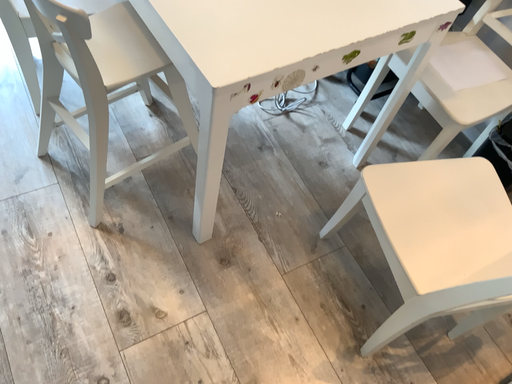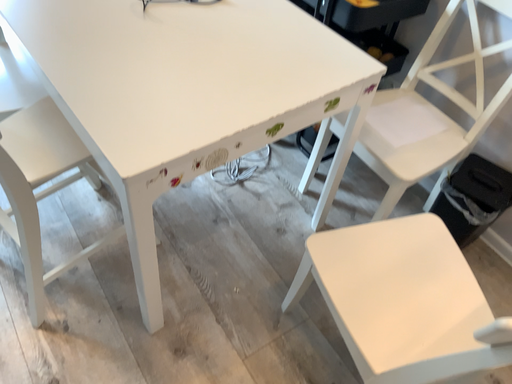
Question: Which way did the camera rotate in the video?

Choices:
 (A) rotated downward
 (B) rotated upward

Answer: (B)